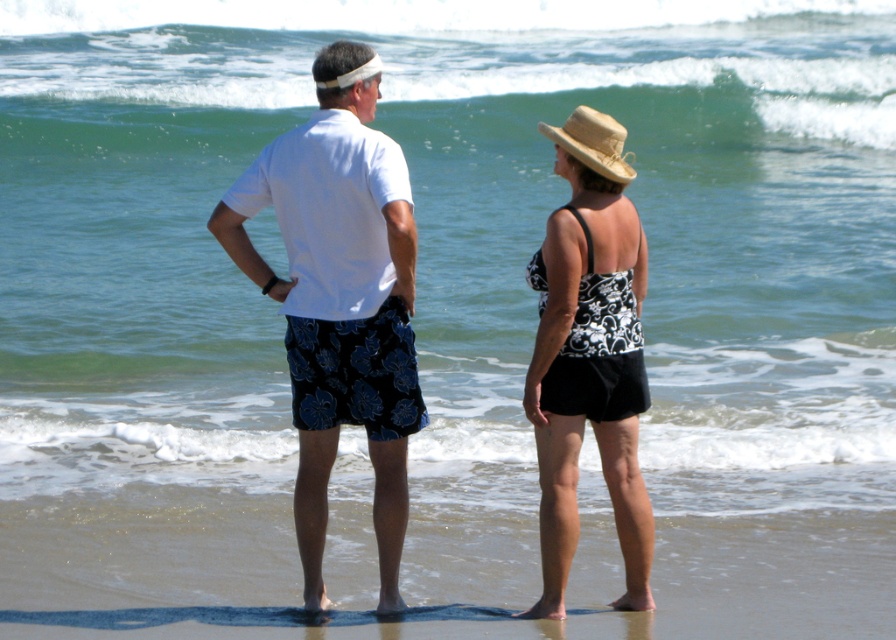
Question: Can you confirm if white cotton shirt at center is positioned to the right of black floral swimsuit at center?

Choices:
 (A) yes
 (B) no

Answer: (B)

Question: Which point is closer to the camera?

Choices:
 (A) white cotton shirt at center
 (B) straw hat at upper right

Answer: (A)

Question: Which is nearer to the brown sand at lower center?

Choices:
 (A) black floral swimsuit at center
 (B) straw hat at upper right

Answer: (A)

Question: Is white cotton shirt at center positioned in front of black floral swimsuit at center?

Choices:
 (A) yes
 (B) no

Answer: (A)

Question: Is brown sand at lower center in front of black floral swimsuit at center?

Choices:
 (A) yes
 (B) no

Answer: (A)

Question: Among these objects, which one is nearest to the camera?

Choices:
 (A) straw hat at upper right
 (B) white cotton shirt at center
 (C) brown sand at lower center

Answer: (C)